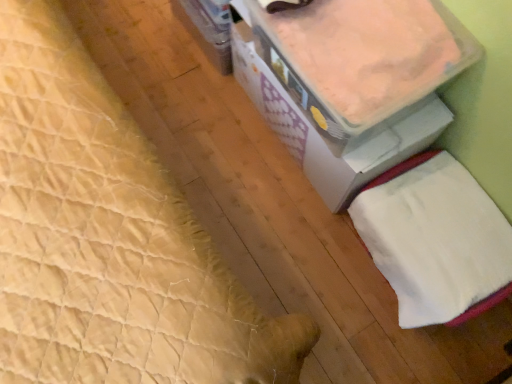
Question: Would you say white soft towel at lower right is to the left or to the right of white cardboard storage box at upper right in the picture?

Choices:
 (A) left
 (B) right

Answer: (B)

Question: From a real-world perspective, relative to white cardboard storage box at upper right, is white soft towel at lower right vertically above or below?

Choices:
 (A) below
 (B) above

Answer: (A)

Question: In terms of height, does white soft towel at lower right look taller or shorter compared to white cardboard storage box at upper right?

Choices:
 (A) tall
 (B) short

Answer: (A)

Question: Is white cardboard storage box at upper right taller or shorter than white soft towel at lower right?

Choices:
 (A) tall
 (B) short

Answer: (B)

Question: In terms of width, does white cardboard storage box at upper right look wider or thinner when compared to white soft towel at lower right?

Choices:
 (A) thin
 (B) wide

Answer: (B)

Question: In terms of size, does white cardboard storage box at upper right appear bigger or smaller than white soft towel at lower right?

Choices:
 (A) small
 (B) big

Answer: (A)

Question: Visually, is white cardboard storage box at upper right positioned to the left or to the right of white soft towel at lower right?

Choices:
 (A) left
 (B) right

Answer: (A)